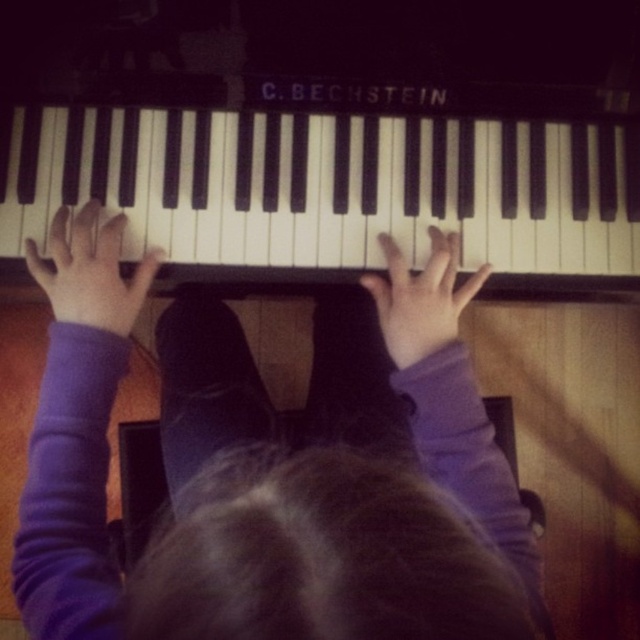
You are a photographer taking a picture of the black polished piano at center and the purple soft hand at center. To ensure both are in the frame, where should you position the camera relative to the piano?

The black polished piano at center is to the right of the purple soft hand at center, so position the camera to the left of the piano to include both in the frame.

You are a photographer trying to capture a close shot of the piano keys. You notice the purple soft hand at center and the black polished piano at center. Which object should you focus on to ensure the piano keys are in clear view?

The black polished piano at center is taller than the purple soft hand at center, so focusing on the black polished piano at center will ensure the piano keys are in clear view.